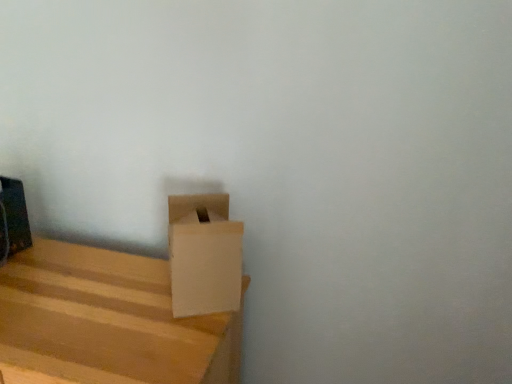
This screenshot has height=384, width=512. What are the coordinates of `blank space situated above light brown wood box at lower left (from a real-world perspective)` in the screenshot? It's located at (84, 296).